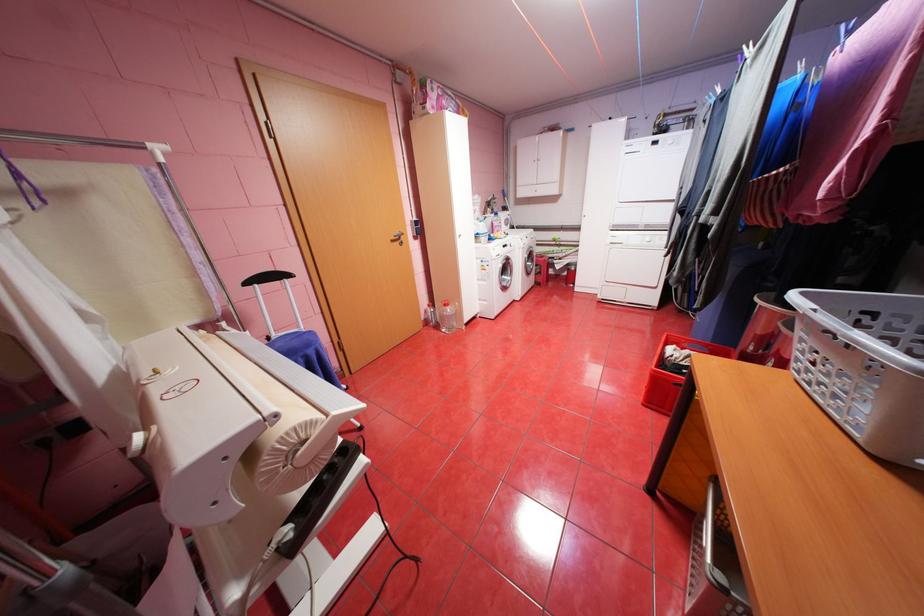
Find the location of a particular element. white machine knob is located at coordinates (140, 442).